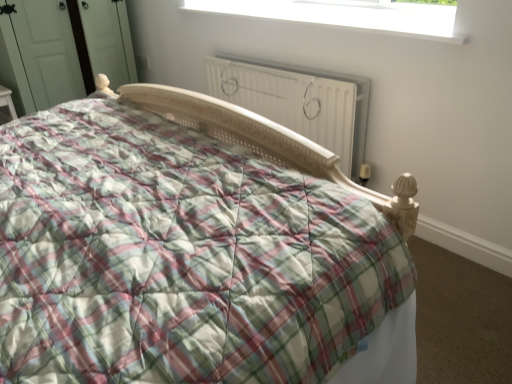
Question: From the image's perspective, relative to white matte radiator at center, is plaid fabric bed at center above or below?

Choices:
 (A) above
 (B) below

Answer: (B)

Question: Considering the positions of plaid fabric bed at center and white matte radiator at center in the image, is plaid fabric bed at center wider or thinner than white matte radiator at center?

Choices:
 (A) thin
 (B) wide

Answer: (B)

Question: Based on their relative distances, which object is nearer to the white matte radiator at center?

Choices:
 (A) plaid fabric bed at center
 (B) white plastic window at upper center

Answer: (B)

Question: Estimate the real-world distances between objects in this image. Which object is closer to the white plastic window at upper center?

Choices:
 (A) plaid fabric bed at center
 (B) white matte radiator at center

Answer: (B)